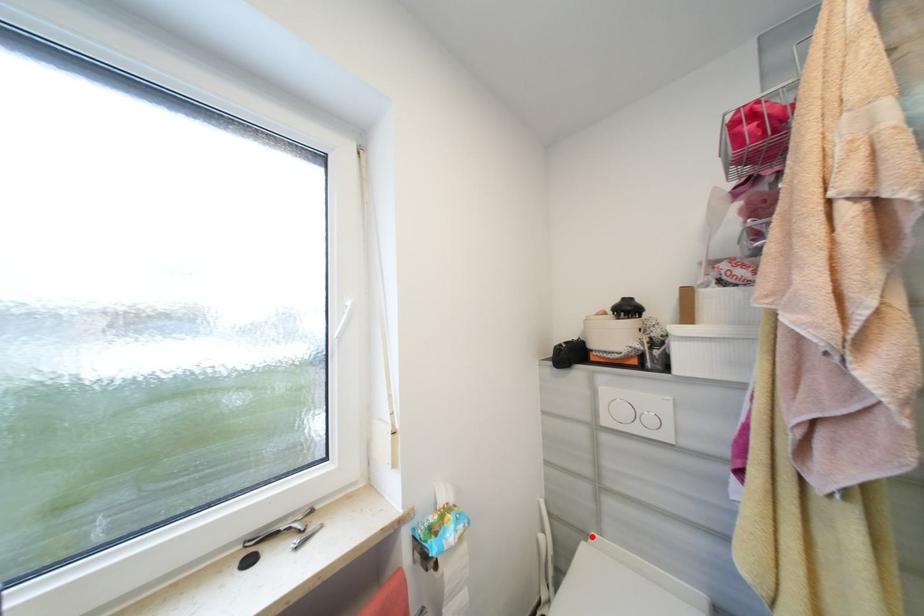
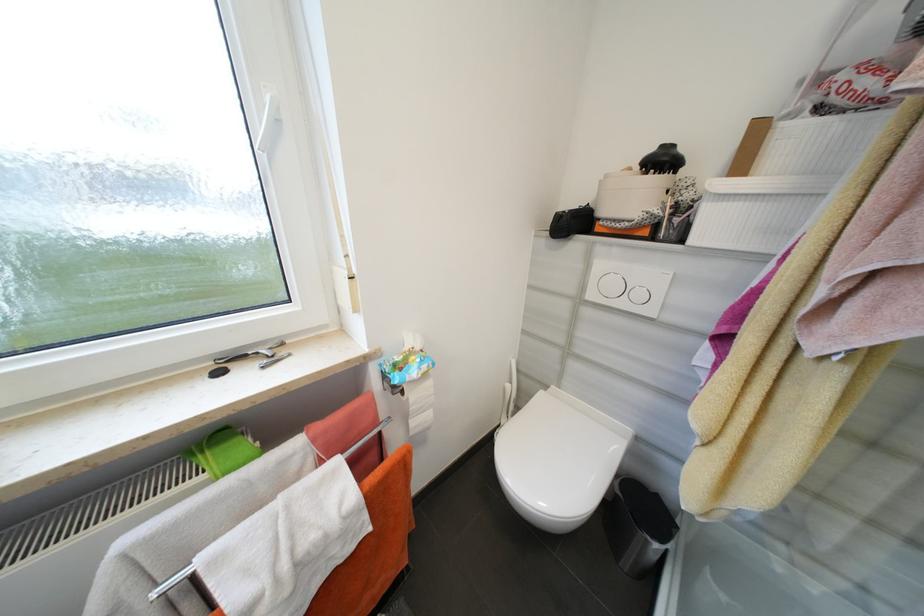
Locate, in the second image, the point that corresponds to the highlighted location in the first image.

(552, 387)